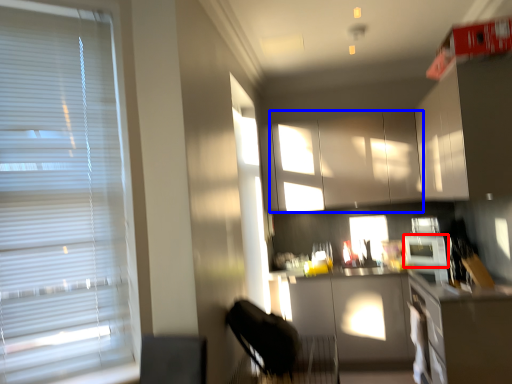
Question: Which of the following is the closest to the observer, appliance (highlighted by a red box) or cabinetry (highlighted by a blue box)?

Choices:
 (A) appliance
 (B) cabinetry

Answer: (A)